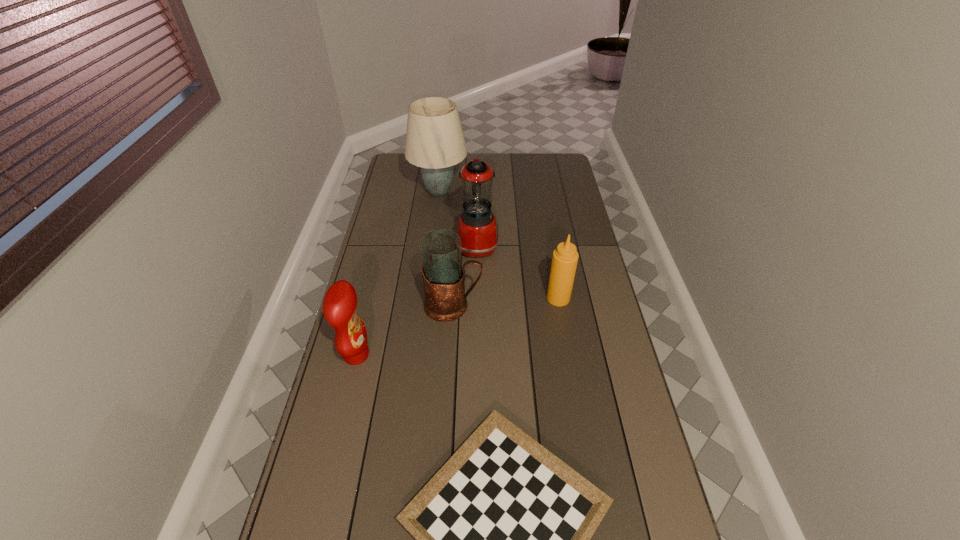
Image resolution: width=960 pixels, height=540 pixels. What are the coordinates of `vacant space located 0.150m on the label side of the nearer condiment` in the screenshot? It's located at 418,355.

You are a GUI agent. You are given a task and a screenshot of the screen. Output one action in this format:
    pyautogui.click(x=<x>, y=<y>)
    Task: Click on the object positioned at the far edge
    The width and height of the screenshot is (960, 540).
    Given the screenshot: What is the action you would take?
    pyautogui.click(x=435, y=142)

Where is `lampshade that is at the left edge`? Image resolution: width=960 pixels, height=540 pixels. lampshade that is at the left edge is located at coordinates (435, 142).

Find the location of `condiment located in the left edge section of the desktop`. condiment located in the left edge section of the desktop is located at coordinates (340, 302).

I want to click on object present at the right edge, so click(565, 257).

What are the coordinates of `object present at the far left corner` in the screenshot? It's located at pos(435,142).

This screenshot has width=960, height=540. What are the coordinates of `vacant space at the far edge of the desktop` in the screenshot? It's located at (487, 158).

You are a GUI agent. You are given a task and a screenshot of the screen. Output one action in this format:
    pyautogui.click(x=<x>, y=<y>)
    Task: Click on the vacant point at the left edge
    The image size is (960, 540).
    Given the screenshot: What is the action you would take?
    pyautogui.click(x=338, y=454)

Where is `free region at the right edge of the desktop`? free region at the right edge of the desktop is located at coordinates (571, 213).

You are a GUI agent. You are given a task and a screenshot of the screen. Output one action in this format:
    pyautogui.click(x=<x>, y=<y>)
    Task: Click on the vacant area that lies between the farthest object and the leftmost object
    The image size is (960, 540).
    Given the screenshot: What is the action you would take?
    pyautogui.click(x=397, y=273)